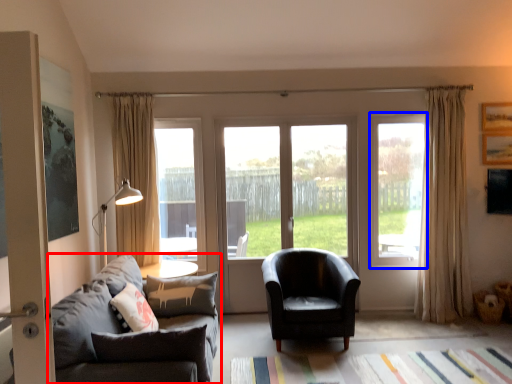
Question: Which object is closer to the camera taking this photo, studio couch (highlighted by a red box) or window (highlighted by a blue box)?

Choices:
 (A) studio couch
 (B) window

Answer: (A)